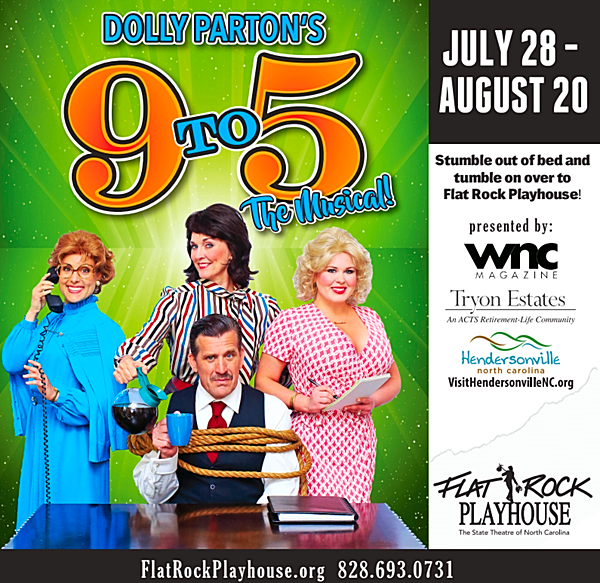
Where is `shiny black tabletop on bottom`? shiny black tabletop on bottom is located at coordinates tap(70, 535), tap(98, 526), tap(386, 540).